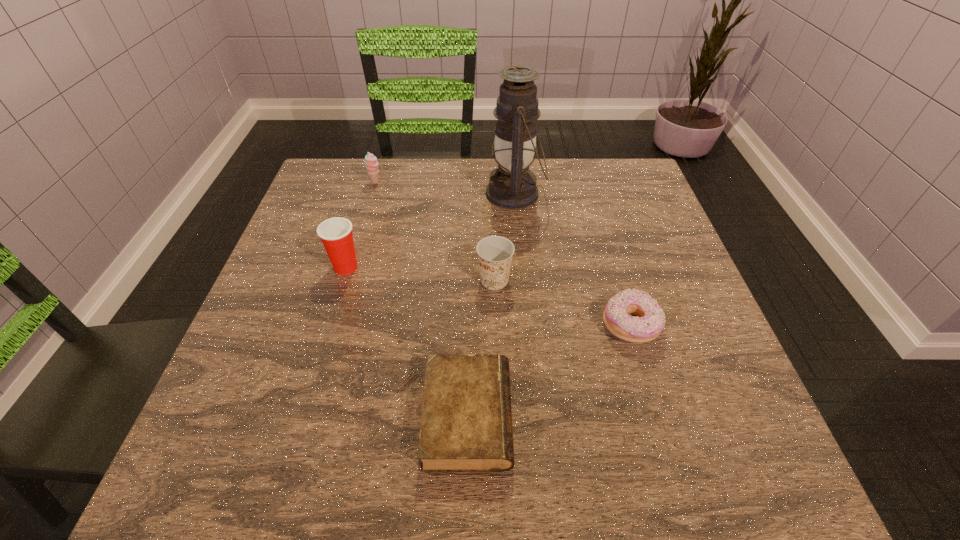
Find the location of a particular element. The width and height of the screenshot is (960, 540). oil lamp is located at coordinates (512, 185).

Locate an element on the screen. This screenshot has height=540, width=960. the left Dixie cup is located at coordinates (336, 234).

In order to click on the fifth shortest object in this screenshot , I will do `click(336, 234)`.

At what (x,y) coordinates should I click in order to perform the action: click on sherbert. Please return your answer as a coordinate pair (x, y). The width and height of the screenshot is (960, 540). Looking at the image, I should click on (371, 162).

Where is `the right Dixie cup`? the right Dixie cup is located at coordinates (495, 253).

The width and height of the screenshot is (960, 540). Find the location of `the fifth farthest object`. the fifth farthest object is located at coordinates (650, 321).

Identify the location of the fifth tallest object. This screenshot has height=540, width=960. (650, 321).

Where is `the shortest object`? Image resolution: width=960 pixels, height=540 pixels. the shortest object is located at coordinates (466, 422).

Where is `the nearest object`? The height and width of the screenshot is (540, 960). the nearest object is located at coordinates (466, 422).

Where is `vacant space located 0.260m on the left of the oil lamp`? Image resolution: width=960 pixels, height=540 pixels. vacant space located 0.260m on the left of the oil lamp is located at coordinates (386, 193).